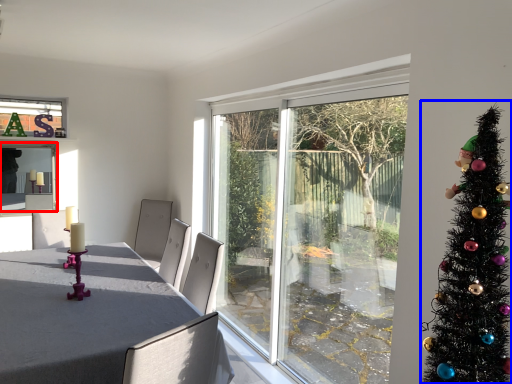
Question: Which point is closer to the camera, window screen (highlighted by a red box) or christmas tree (highlighted by a blue box)?

Choices:
 (A) window screen
 (B) christmas tree

Answer: (B)